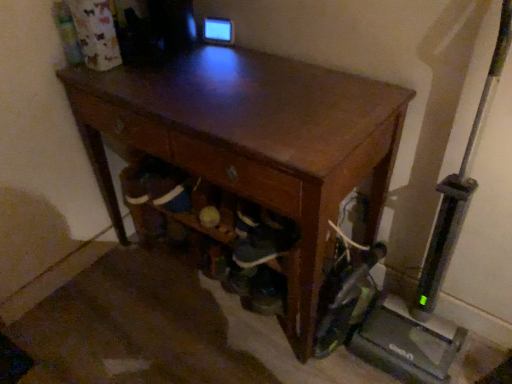
Question: Can you confirm if shiny brown desk at center is wider than wooden drawer at center?

Choices:
 (A) yes
 (B) no

Answer: (A)

Question: Is shiny brown desk at center at the right side of wooden drawer at center?

Choices:
 (A) yes
 (B) no

Answer: (A)

Question: Considering the relative sizes of shiny brown desk at center and wooden drawer at center in the image provided, is shiny brown desk at center bigger than wooden drawer at center?

Choices:
 (A) no
 (B) yes

Answer: (B)

Question: Could you tell me if shiny brown desk at center is facing wooden drawer at center?

Choices:
 (A) yes
 (B) no

Answer: (A)

Question: Can you confirm if shiny brown desk at center is shorter than wooden drawer at center?

Choices:
 (A) yes
 (B) no

Answer: (B)

Question: Is shiny brown desk at center outside of wooden drawer at center?

Choices:
 (A) yes
 (B) no

Answer: (A)

Question: From the image's perspective, would you say wooden drawer at center is shown under shiny brown desk at center?

Choices:
 (A) yes
 (B) no

Answer: (B)

Question: Is wooden drawer at center facing away from shiny brown desk at center?

Choices:
 (A) yes
 (B) no

Answer: (A)

Question: Considering the relative positions of wooden drawer at center and shiny brown desk at center in the image provided, is wooden drawer at center to the right of shiny brown desk at center from the viewer's perspective?

Choices:
 (A) yes
 (B) no

Answer: (B)

Question: Is shiny brown desk at center located within wooden drawer at center?

Choices:
 (A) yes
 (B) no

Answer: (B)

Question: From a real-world perspective, is wooden drawer at center positioned over shiny brown desk at center based on gravity?

Choices:
 (A) yes
 (B) no

Answer: (A)

Question: Are wooden drawer at center and shiny brown desk at center far apart?

Choices:
 (A) no
 (B) yes

Answer: (A)

Question: Is point (279, 196) closer or farther from the camera than point (371, 198)?

Choices:
 (A) closer
 (B) farther

Answer: (A)